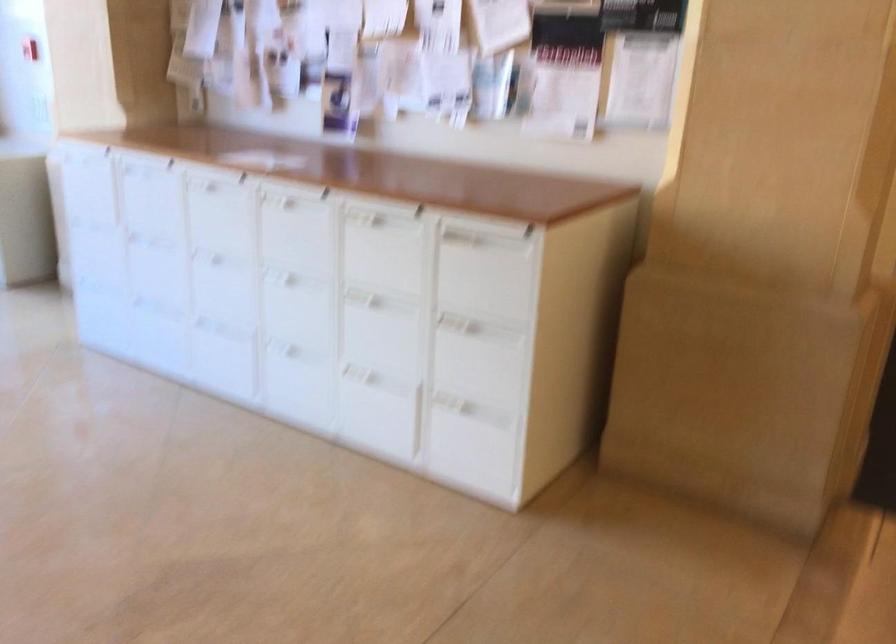
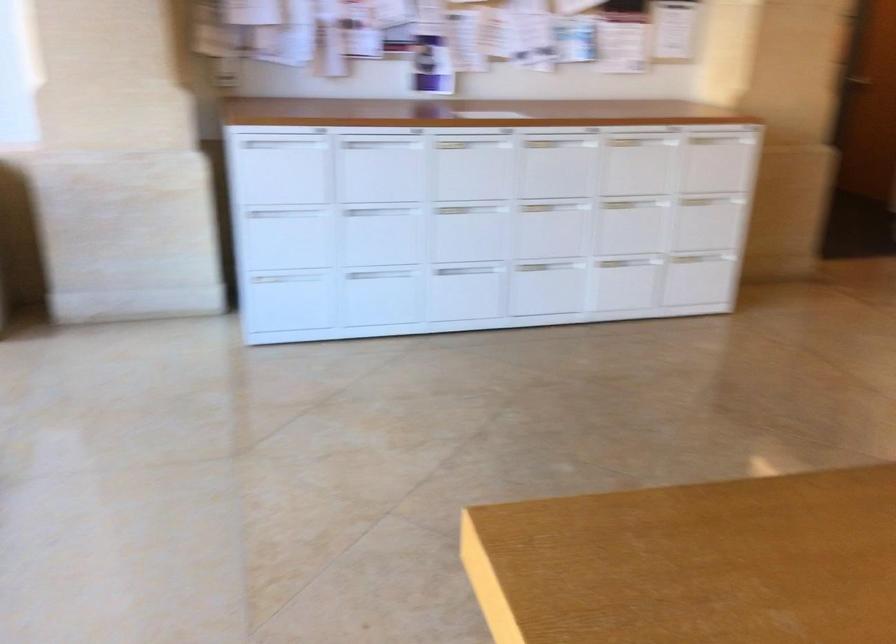
Where in the second image is the point corresponding to point (76, 176) from the first image?

(280, 167)